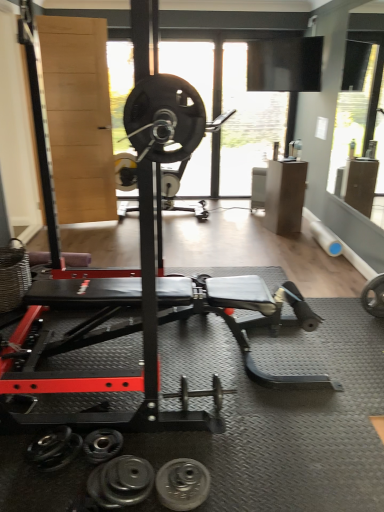
I want to click on vacant area that is situated to the right of black rubber weight plate at lower center, so click(230, 483).